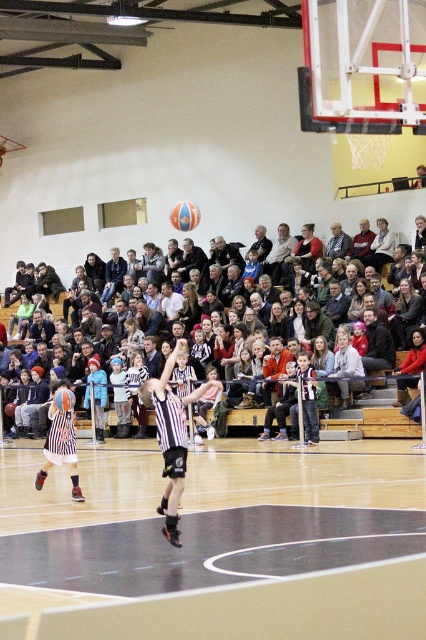
You are standing at the entrance of the gymnasium and want to locate the striped jersey at center. According to the coordinate system where the bottom left corner is the origin, which direction should you look to find it?

The striped jersey at center is located at point coordinates of 0.694 along the x axis and 0.141 along the y axis. Since the x value is higher than the y value, it means the jersey is more to the right and slightly forward from the entrance. So you should look towards the right side and slightly forward direction from the entrance to locate it.

You are a photographer standing at the back of the gymnasium. You want to capture a photo of the black rubber court at center and the matte black jacket at upper center in the same frame. Which object should you focus on first to ensure both are in focus?

The black rubber court at center has a lesser width compared to matte black jacket at upper center. Since the court is narrower, you should focus on the matte black jacket at upper center first to ensure both objects are in focus.